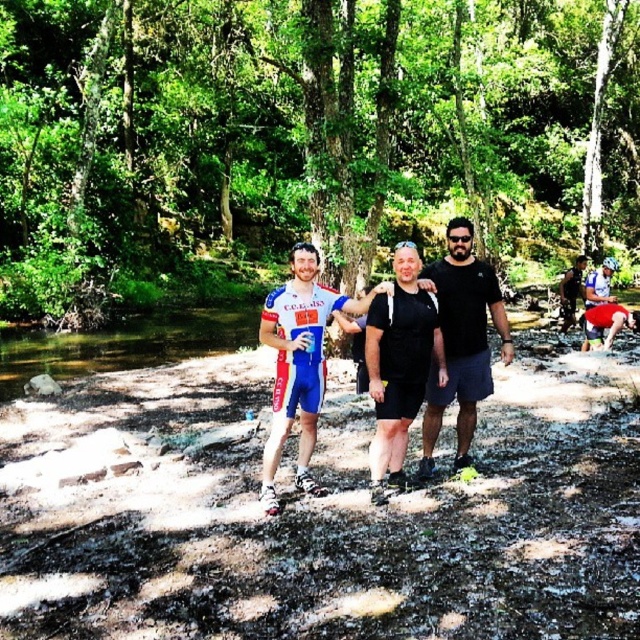
Does black matte shorts at center have a greater width compared to blue fabric shorts at center?

No.

Can you confirm if black matte shorts at center is positioned above blue fabric shorts at center?

Actually, black matte shorts at center is below blue fabric shorts at center.

Which is behind, point (396, 323) or point (572, 276)?

Point (572, 276)

Where is `black matte shorts at center`? black matte shorts at center is located at coordinates (400, 364).

Between matte blue shorts at center and blue fabric shorts at center, which one has more height?

blue fabric shorts at center is taller.

Between matte blue shorts at center and blue fabric shorts at center, which one appears on the right side from the viewer's perspective?

blue fabric shorts at center

You are a GUI agent. You are given a task and a screenshot of the screen. Output one action in this format:
    pyautogui.click(x=<x>, y=<y>)
    Task: Click on the matte blue shorts at center
    The height and width of the screenshot is (640, 640).
    Given the screenshot: What is the action you would take?
    pyautogui.click(x=320, y=513)

Locate an element on the screen. The image size is (640, 640). matte blue shorts at center is located at coordinates (320, 513).

Can you confirm if blue cycling jersey at center is wider than black matte shorts at center?

Yes.

Who is positioned more to the left, blue cycling jersey at center or black matte shorts at center?

From the viewer's perspective, blue cycling jersey at center appears more on the left side.

Which is in front, point (307, 477) or point (401, 436)?

Positioned in front is point (401, 436).

At what (x,y) coordinates should I click in order to perform the action: click on blue cycling jersey at center. Please return your answer as a coordinate pair (x, y). This screenshot has height=640, width=640. Looking at the image, I should click on (300, 362).